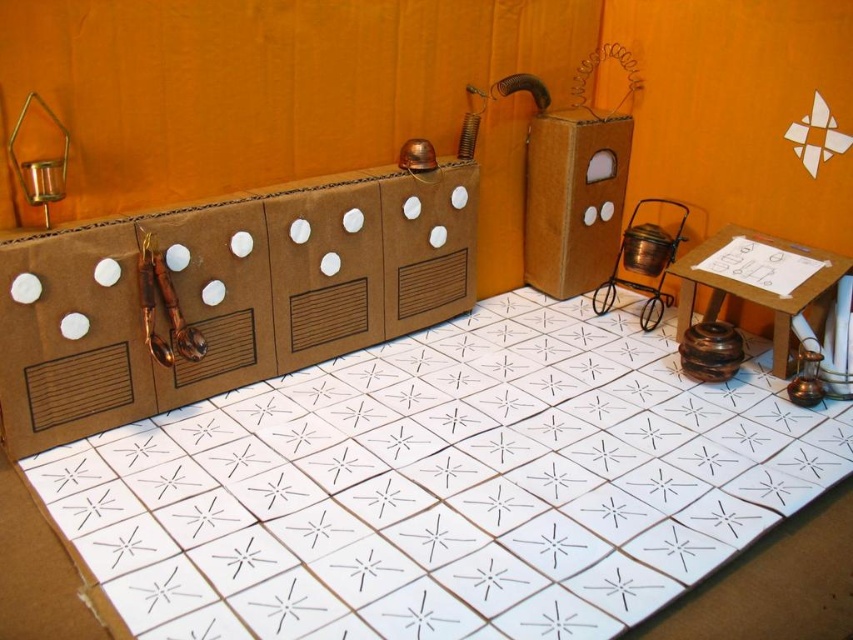
You are setting up a small table in the diorama and need to place both the brown cardboard box at center and the metallic candlestick at left. Based on their positions, which object should you place closer to the front of the table?

The brown cardboard box at center should be placed closer to the front of the table because it is in front of the metallic candlestick at left.

You are setting up a model kitchen and need to place both the white cardboard floor at center and the brown cardboard box at center in the diorama. Based on their sizes, which one should you place first to ensure proper positioning?

The white cardboard floor at center is larger in size than the brown cardboard box at center, so you should place the white cardboard floor at center first to ensure it has enough space and proper positioning before placing the smaller brown cardboard box at center on top of or beside it.

You are setting up a small toy kitchen scene and need to place a toy that requires a stable surface. Which object between the white cardboard floor at center and the brown cardboard box at center would be more suitable for placing the toy?

The brown cardboard box at center is taller than the white cardboard floor at center, so the brown cardboard box at center provides a more stable surface for placing the toy.